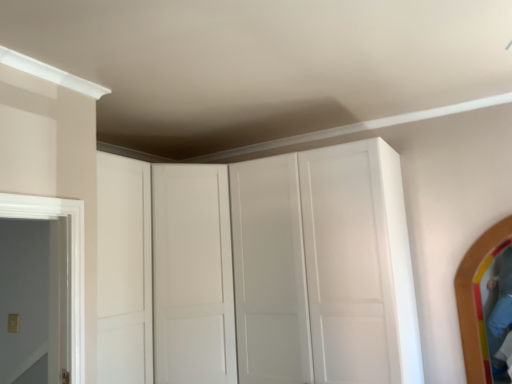
Question: Does wooden mirror at right have a greater width compared to white matte cabinet at center?

Choices:
 (A) yes
 (B) no

Answer: (B)

Question: Is wooden mirror at right positioned with its back to white matte cabinet at center?

Choices:
 (A) no
 (B) yes

Answer: (A)

Question: Is wooden mirror at right completely or partially outside of white matte cabinet at center?

Choices:
 (A) no
 (B) yes

Answer: (B)

Question: Does wooden mirror at right lie in front of white matte cabinet at center?

Choices:
 (A) yes
 (B) no

Answer: (B)

Question: From a real-world perspective, does wooden mirror at right stand above white matte cabinet at center?

Choices:
 (A) no
 (B) yes

Answer: (A)

Question: Can you confirm if wooden mirror at right is smaller than white matte cabinet at center?

Choices:
 (A) no
 (B) yes

Answer: (B)

Question: Is white matte cabinet at center to the right of wooden mirror at right from the viewer's perspective?

Choices:
 (A) no
 (B) yes

Answer: (A)

Question: Can you confirm if white matte cabinet at center is taller than wooden mirror at right?

Choices:
 (A) no
 (B) yes

Answer: (B)

Question: Can you confirm if white matte cabinet at center is positioned to the left of wooden mirror at right?

Choices:
 (A) yes
 (B) no

Answer: (A)

Question: Could wooden mirror at right be considered to be inside white matte cabinet at center?

Choices:
 (A) no
 (B) yes

Answer: (A)

Question: From a real-world perspective, is white matte cabinet at center below wooden mirror at right?

Choices:
 (A) yes
 (B) no

Answer: (B)

Question: Is white matte cabinet at center far from wooden mirror at right?

Choices:
 (A) yes
 (B) no

Answer: (A)

Question: From the image's perspective, is wooden mirror at right located above or below white matte cabinet at center?

Choices:
 (A) below
 (B) above

Answer: (A)